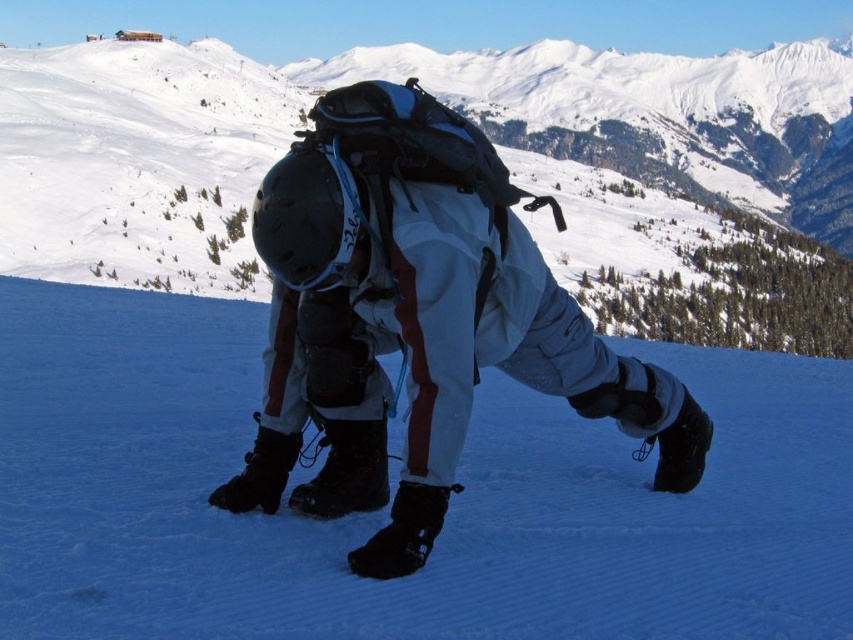
Is white matte snow at center above white matte snowsuit at center?

No.

Who is more distant from viewer, (643, 525) or (331, 138)?

Positioned behind is point (331, 138).

You are a GUI agent. You are given a task and a screenshot of the screen. Output one action in this format:
    pyautogui.click(x=<x>, y=<y>)
    Task: Click on the white matte snow at center
    Image resolution: width=853 pixels, height=640 pixels.
    Given the screenshot: What is the action you would take?
    pyautogui.click(x=387, y=506)